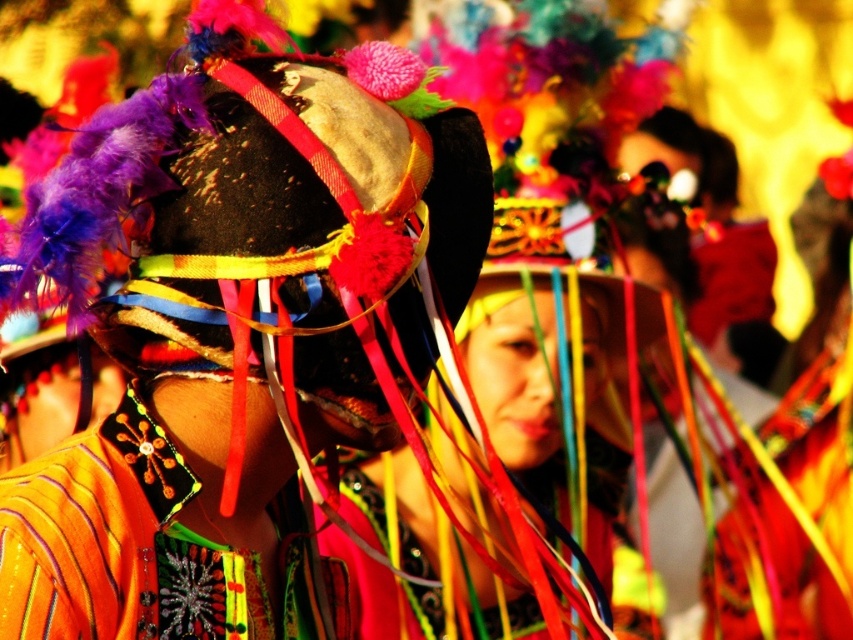
You are a photographer standing at the center of the festival scene. You want to take a closeup shot of both the matte black headdress at center and the orange fabric necklace at center. Given that your camera has a maximum focus range of 6 feet, will you be able to capture both objects in focus at the same time?

The matte black headdress at center is 6.24 feet away from the orange fabric necklace at center. Since the distance between them exceeds the camera maximum focus range of 6 feet, you cannot capture both objects in focus simultaneously.

Consider the image. You are a photographer attending the festival and want to capture a clear shot of both the matte black headdress at center and the orange fabric necklace at center. Since the headdress is larger, which object should you focus on to ensure both are in frame?

The matte black headdress at center is larger than the orange fabric necklace at center, so focusing on the matte black headdress at center will ensure both are in frame as it takes up more space.